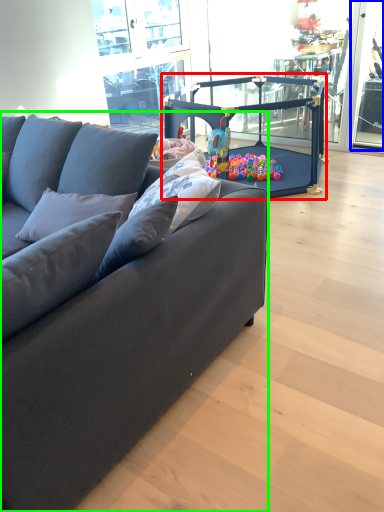
Question: Which object is positioned farthest from baby carriage (highlighted by a red box)? Select from window screen (highlighted by a blue box) and studio couch (highlighted by a green box).

Choices:
 (A) window screen
 (B) studio couch

Answer: (B)